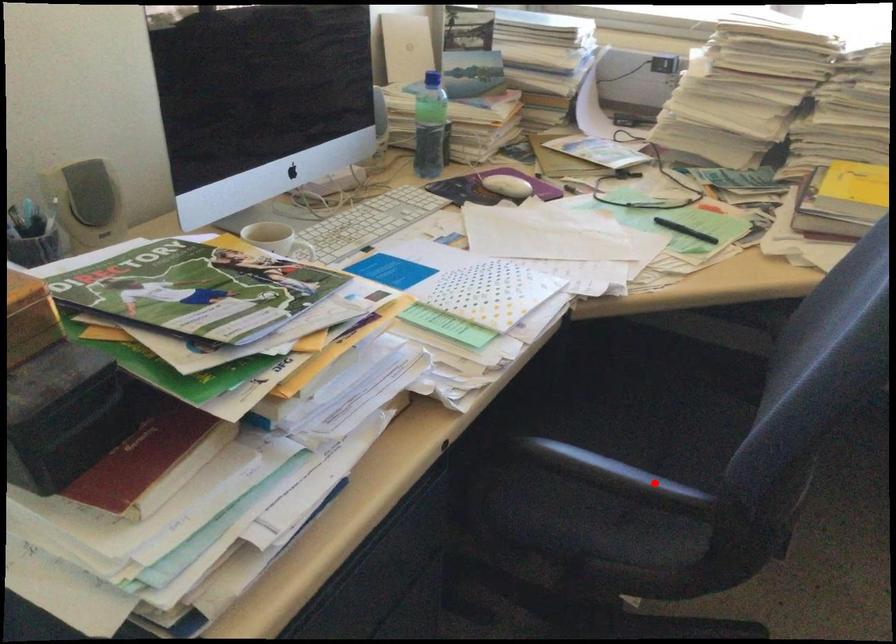
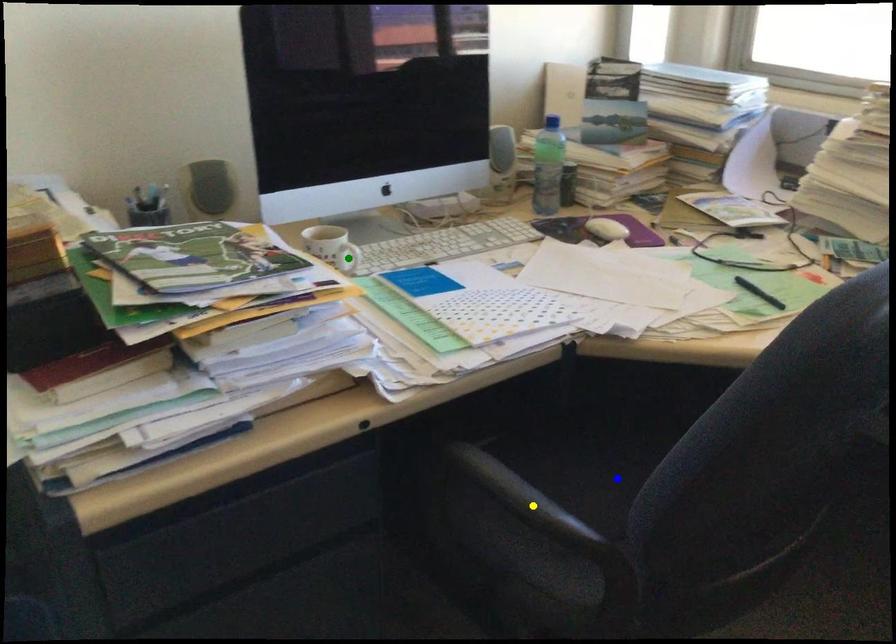
Question: I am providing you with two images of the same scene from different viewpoints. A red point is marked on the first image. You are given multiple points on the second image. Can you choose the point in image 2 that corresponds to the point in image 1?

Choices:
 (A) green point
 (B) blue point
 (C) yellow point

Answer: (C)